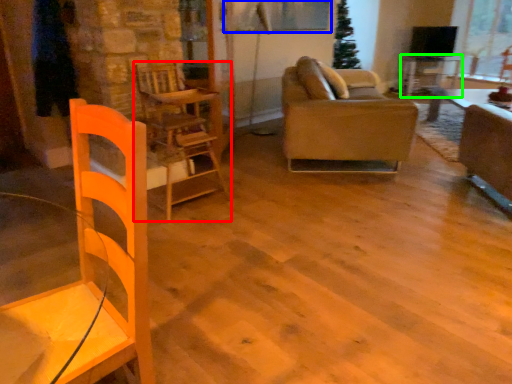
Question: Which is farther away from chair (highlighted by a red box)? window screen (highlighted by a blue box) or table (highlighted by a green box)?

Choices:
 (A) window screen
 (B) table

Answer: (B)